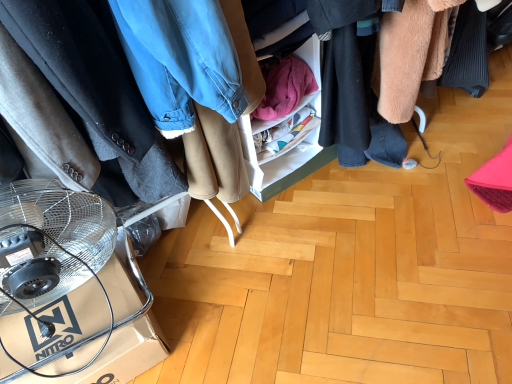
The height and width of the screenshot is (384, 512). What do you see at coordinates (85, 66) in the screenshot?
I see `soft woolen coat at center` at bounding box center [85, 66].

Image resolution: width=512 pixels, height=384 pixels. What are the coordinates of `soft woolen coat at center` in the screenshot? It's located at (85, 66).

Measure the distance between soft woolen coat at center and camera.

The depth of soft woolen coat at center is 28.76 inches.

Identify the location of soft woolen coat at center. The height and width of the screenshot is (384, 512). (85, 66).